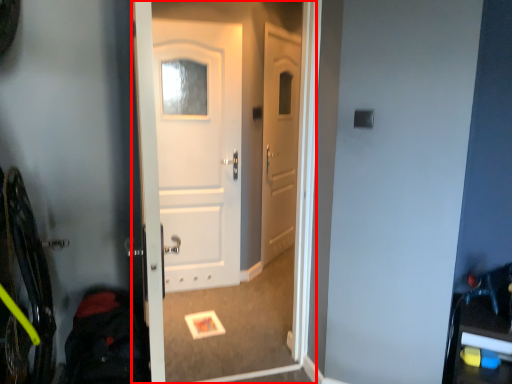
Question: From the image's perspective, what is the correct spatial relationship of screen door (annotated by the red box) in relation to back?

Choices:
 (A) above
 (B) below

Answer: (A)